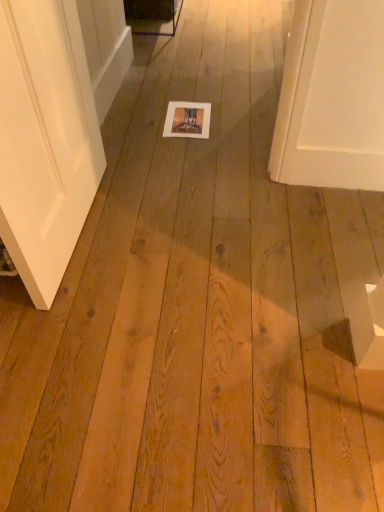
Question: Is white glossy screen door at upper left positioned far away from matte cardboard postcard at center?

Choices:
 (A) no
 (B) yes

Answer: (A)

Question: Is white glossy screen door at upper left positioned with its back to matte cardboard postcard at center?

Choices:
 (A) yes
 (B) no

Answer: (B)

Question: From the image's perspective, is white glossy screen door at upper left below matte cardboard postcard at center?

Choices:
 (A) no
 (B) yes

Answer: (A)

Question: Can you confirm if white glossy screen door at upper left is positioned to the right of matte cardboard postcard at center?

Choices:
 (A) no
 (B) yes

Answer: (A)

Question: Considering the relative positions of white glossy screen door at upper left and matte cardboard postcard at center in the image provided, is white glossy screen door at upper left behind matte cardboard postcard at center?

Choices:
 (A) no
 (B) yes

Answer: (A)

Question: Does white glossy screen door at upper left have a lesser height compared to matte cardboard postcard at center?

Choices:
 (A) yes
 (B) no

Answer: (B)

Question: Does matte cardboard postcard at center have a greater height compared to white glossy screen door at upper left?

Choices:
 (A) no
 (B) yes

Answer: (A)

Question: Can you confirm if matte cardboard postcard at center is bigger than white glossy screen door at upper left?

Choices:
 (A) yes
 (B) no

Answer: (B)

Question: Is white glossy screen door at upper left surrounded by matte cardboard postcard at center?

Choices:
 (A) yes
 (B) no

Answer: (B)

Question: From a real-world perspective, is matte cardboard postcard at center positioned under white glossy screen door at upper left based on gravity?

Choices:
 (A) yes
 (B) no

Answer: (A)

Question: From the image's perspective, would you say matte cardboard postcard at center is positioned over white glossy screen door at upper left?

Choices:
 (A) no
 (B) yes

Answer: (A)

Question: Is matte cardboard postcard at center not near white glossy screen door at upper left?

Choices:
 (A) yes
 (B) no

Answer: (B)

Question: Which is correct: white glossy screen door at upper left is inside matte cardboard postcard at center, or outside of it?

Choices:
 (A) inside
 (B) outside

Answer: (B)